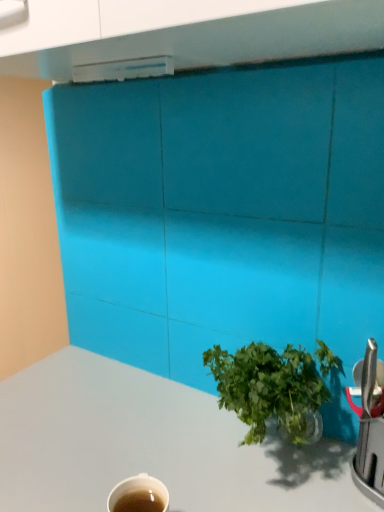
Locate an element on the screen. The height and width of the screenshot is (512, 384). free point above white glossy counter top at center (from a real-world perspective) is located at coordinates (140, 433).